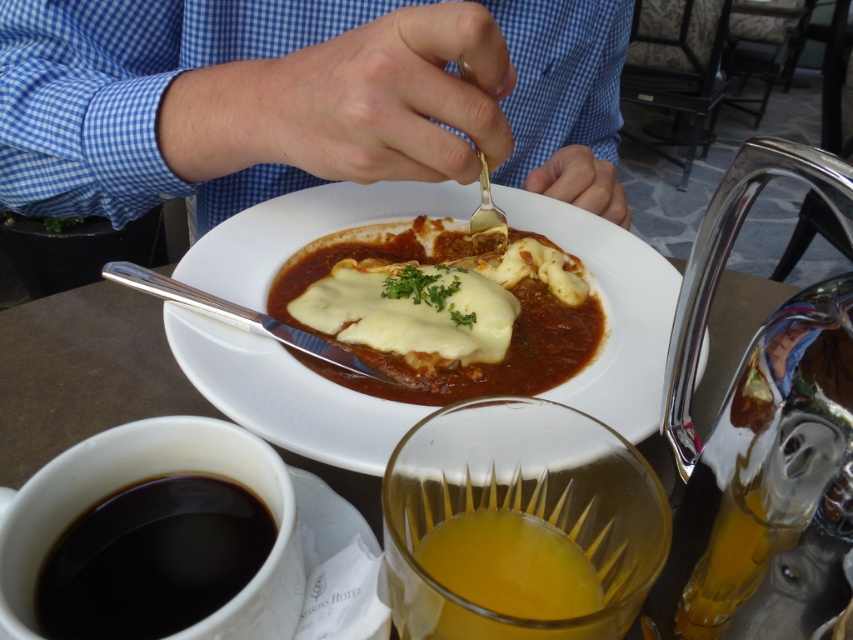
You are a fashion designer analyzing the image. Where is the blue checkered shirt at upper center located in the image?

The blue checkered shirt at upper center is located at point 0.156 on the x axis and 0.356 on the y axis.

What is the 2D coordinate of the blue checkered shirt at upper center?

The blue checkered shirt at upper center is located at the coordinate point of (303, 99).

You are a photographer trying to capture the white creamy lasagna at center without the blue checkered shirt at upper center blocking the view. Can you adjust your position to do so?

The blue checkered shirt at upper center is in front of the white creamy lasagna at center, so moving your position to the side or behind the shirt might allow you to see the lasagna without obstruction.